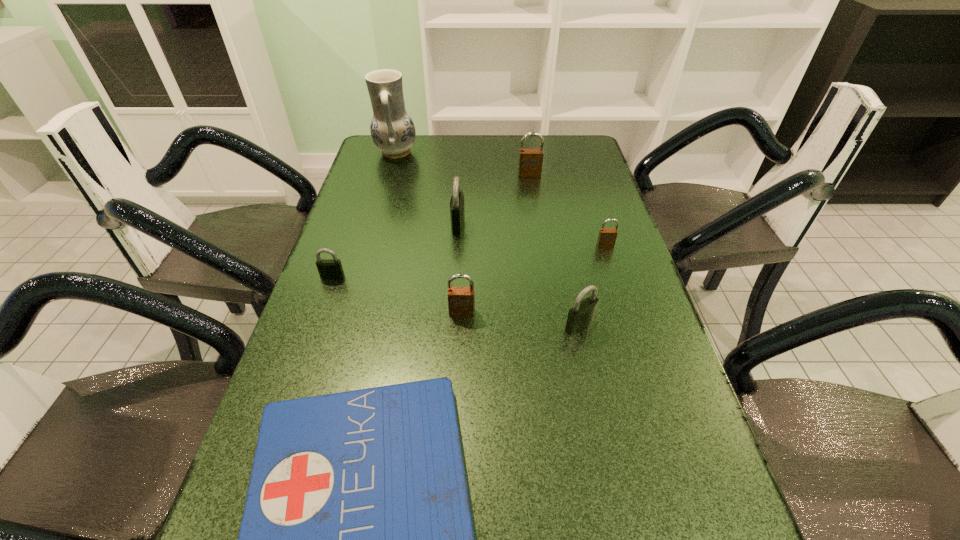
Identify the location of free region located 0.280m on the front of the second farthest black padlock. (298, 375).

The image size is (960, 540). I want to click on object situated at the far edge, so click(x=393, y=132).

Identify the location of pottery that is at the left edge. This screenshot has height=540, width=960. (393, 132).

Where is `padlock located at the left edge`? padlock located at the left edge is located at coordinates (328, 268).

Locate an element on the screen. object present at the far left corner is located at coordinates (393, 132).

In the image, there is a desktop. Where is `free space at the far edge`? free space at the far edge is located at coordinates (532, 136).

The height and width of the screenshot is (540, 960). I want to click on vacant space at the left edge, so click(x=340, y=225).

Where is `free spot at the right edge of the desktop`? Image resolution: width=960 pixels, height=540 pixels. free spot at the right edge of the desktop is located at coordinates 622,248.

At what (x,y) coordinates should I click in order to perform the action: click on vacant area between the blue pottery and the leftmost black padlock. Please return your answer as a coordinate pair (x, y). Image resolution: width=960 pixels, height=540 pixels. Looking at the image, I should click on tap(364, 214).

Where is `unoccupied area between the fourth nearest padlock and the leftmost black padlock`? Image resolution: width=960 pixels, height=540 pixels. unoccupied area between the fourth nearest padlock and the leftmost black padlock is located at coordinates (468, 261).